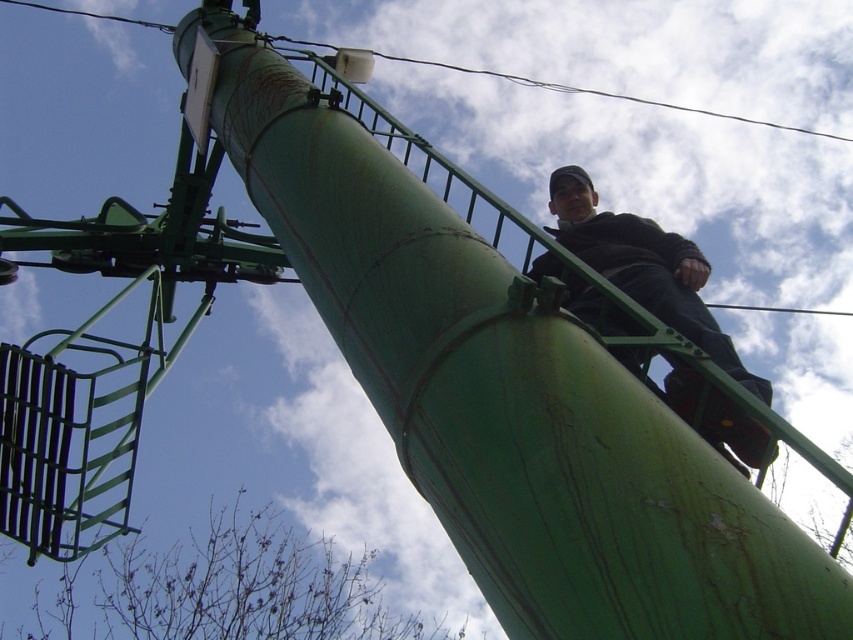
Question: Which of the following is the farthest from the observer?

Choices:
 (A) green painted metal pole at upper center
 (B) black matte jacket at upper right

Answer: (A)

Question: Is black matte jacket at upper right above green painted metal pole at upper center?

Choices:
 (A) yes
 (B) no

Answer: (B)

Question: Is black matte jacket at upper right below green painted metal pole at upper center?

Choices:
 (A) yes
 (B) no

Answer: (A)

Question: Can you confirm if black matte jacket at upper right is bigger than green painted metal pole at upper center?

Choices:
 (A) no
 (B) yes

Answer: (A)

Question: Which point is closer to the camera?

Choices:
 (A) black matte jacket at upper right
 (B) green painted metal pole at upper center

Answer: (A)

Question: Which object appears farthest from the camera in this image?

Choices:
 (A) green painted metal pole at upper center
 (B) black matte jacket at upper right

Answer: (A)